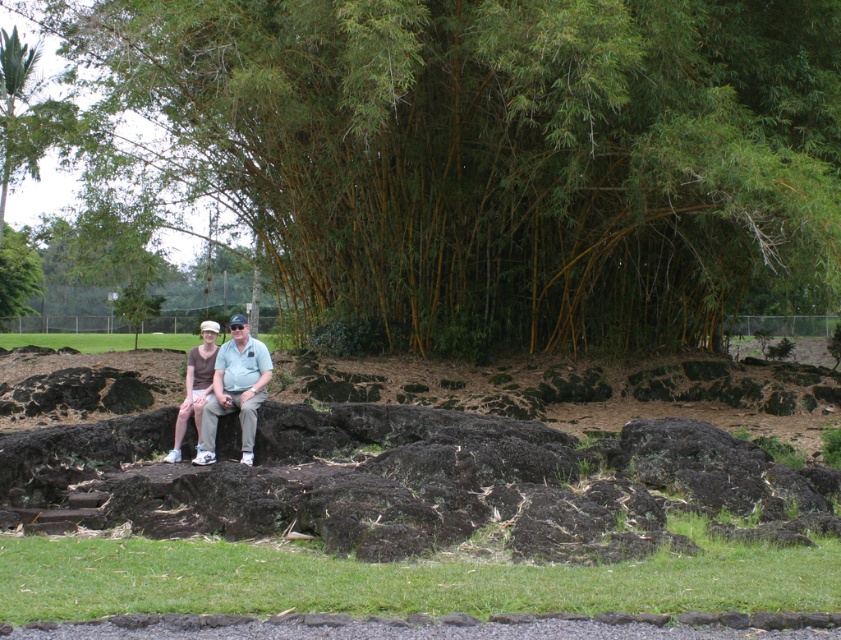
Who is higher up, green bamboo at upper center or rough stone bench at center?

green bamboo at upper center is above.

Describe the element at coordinates (490, 156) in the screenshot. I see `green bamboo at upper center` at that location.

Between point (458, 8) and point (484, 452), which one is positioned in front?

Point (484, 452) is more forward.

Where is `green bamboo at upper center`? green bamboo at upper center is located at coordinates (490, 156).

Does green bamboo at upper center lie behind brown soil at center?

Yes, green bamboo at upper center is further from the viewer.

Is point (521, 316) behind point (278, 362)?

Yes, point (521, 316) is farther from viewer.

Image resolution: width=841 pixels, height=640 pixels. What do you see at coordinates (490, 156) in the screenshot? I see `green bamboo at upper center` at bounding box center [490, 156].

Where is `green bamboo at upper center`? green bamboo at upper center is located at coordinates (490, 156).

Is rough stone bench at center positioned behind brown cotton shirt at center?

That is False.

At what (x,y) coordinates should I click in order to perform the action: click on rough stone bench at center. Please return your answer as a coordinate pair (x, y). Image resolution: width=841 pixels, height=640 pixels. Looking at the image, I should click on (363, 522).

Between point (434, 522) and point (201, 365), which one is positioned behind?

Point (201, 365)

This screenshot has width=841, height=640. I want to click on rough stone bench at center, so click(363, 522).